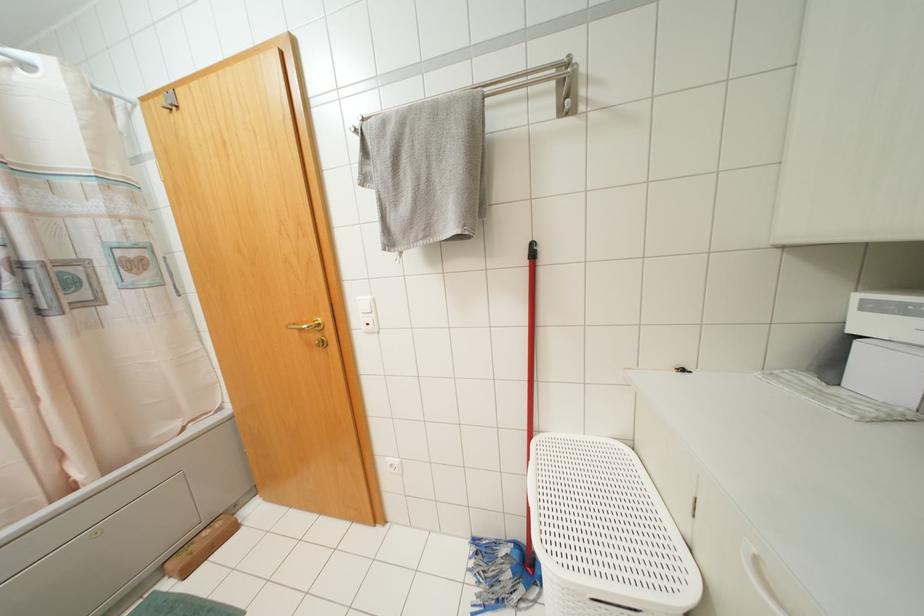
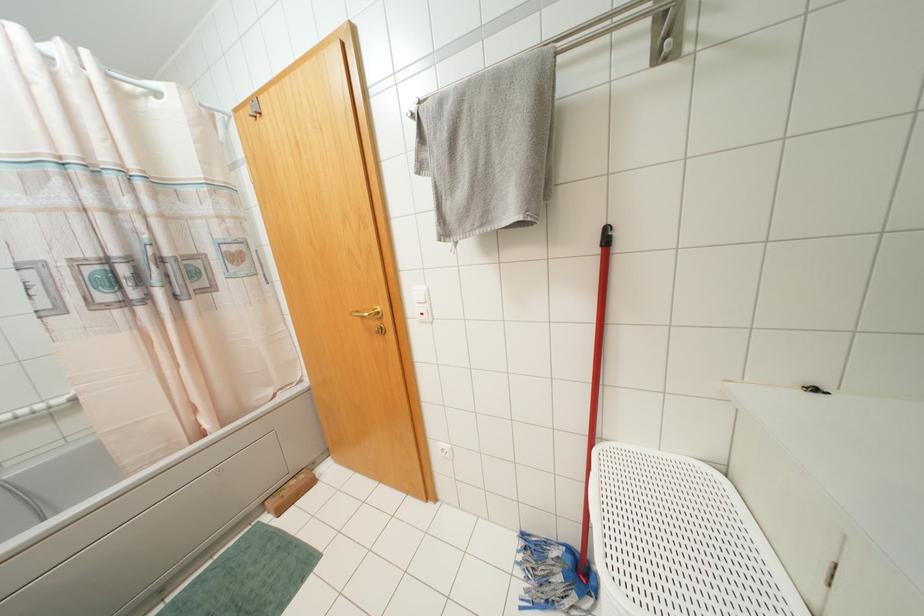
Find the pixel in the second image that matches point (372, 299) in the first image.

(428, 290)